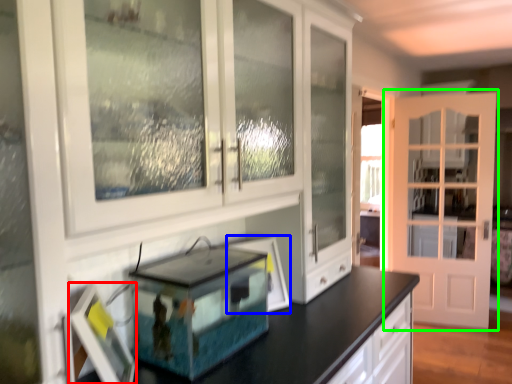
Question: Based on their relative distances, which object is nearer to picture frame (highlighted by a red box)? Choose from picture frame (highlighted by a blue box) and door (highlighted by a green box).

Choices:
 (A) picture frame
 (B) door

Answer: (A)